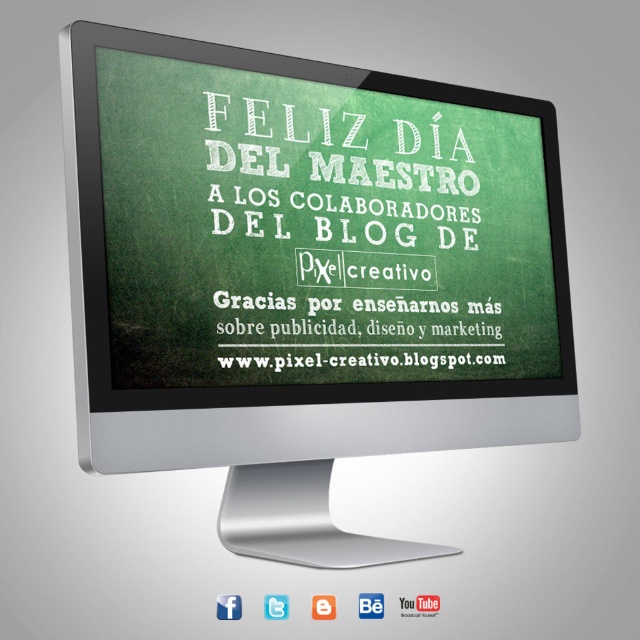
You are standing in a classroom and see the silver metallic computer monitor at center and the white chalkboard at center. Which object is more to the left?

The silver metallic computer monitor at center is more to the left because it is positioned on the left side of the white chalkboard at center.

You are standing in a room with a silver metallic computer monitor at center and a white chalkboard at center. Which object is positioned closer to you?

The silver metallic computer monitor at center is closer to the viewer than the white chalkboard at center.

You are setting up a classroom display and need to place the silver metallic computer monitor at center and the white chalkboard at center side by side. Based on the scene description, which object should be placed first to ensure they fit properly?

The silver metallic computer monitor at center should be placed first because its width is greater than the white chalkboard at center, so positioning it first ensures there is enough space for both objects.